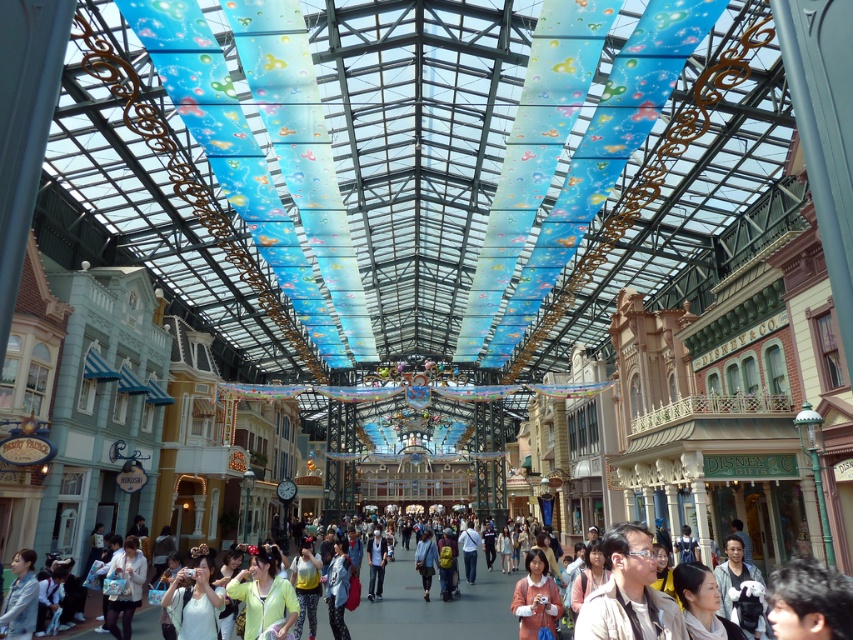
From the picture: You are standing in the Disney marketplace and want to take a photo that includes both the point at coordinates point (519, 628) and point (384, 540). Which point should you focus on first to ensure both are in the frame?

You should focus on point (519, 628) first because it is closer to you than point (384, 540), ensuring both points are within the camera frame.

From the picture: You are standing at the entrance of the marketplace and want to find the matte purple shirt at lower right. Based on the coordinates provided, in which direction should you move to locate it?

The matte purple shirt at lower right is located at coordinates approximately 0.934 on the x axis and 0.628 on the y axis. Since you are at the entrance, moving towards the lower right direction would lead you to the shirt.

You are a photographer at the Disney marketplace. You have a limited amount of space in your camera frame. Which object between the light brown leather jacket at lower right and the light blue denim jeans at center would you prioritize capturing if you want to focus on the smaller object?

The light brown leather jacket at lower right occupies less space than the light blue denim jeans at center, so you should prioritize capturing the light brown leather jacket at lower right since it is smaller.